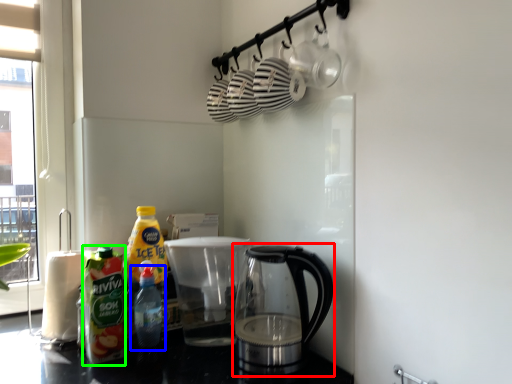
Question: Which object is the closest to the kettle (highlighted by a red box)? Choose among these: bottle (highlighted by a blue box) or bottle (highlighted by a green box).

Choices:
 (A) bottle
 (B) bottle

Answer: (A)